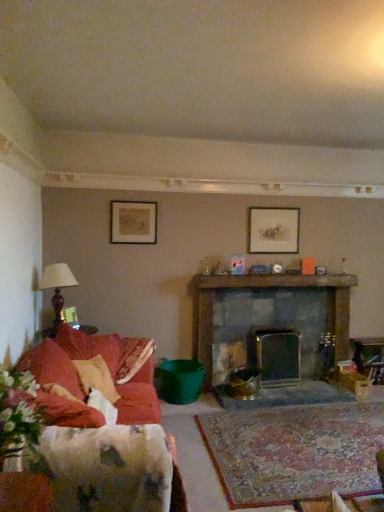
Question: Is the depth of velvet red couch at left greater than that of matte gold picture frame at left, arranged as the first picture frame when viewed from the front?

Choices:
 (A) yes
 (B) no

Answer: (B)

Question: Is matte gold picture frame at left, which is counted as the third picture frame, starting from the top, at the back of velvet red couch at left?

Choices:
 (A) no
 (B) yes

Answer: (B)

Question: Can you confirm if velvet red couch at left is thinner than matte gold picture frame at left, marked as the first picture frame in a left-to-right arrangement?

Choices:
 (A) yes
 (B) no

Answer: (B)

Question: Considering the relative sizes of velvet red couch at left and matte gold picture frame at left, the first picture frame when ordered from bottom to top, in the image provided, is velvet red couch at left shorter than matte gold picture frame at left, the first picture frame when ordered from bottom to top,?

Choices:
 (A) yes
 (B) no

Answer: (B)

Question: From a real-world perspective, is velvet red couch at left positioned under matte gold picture frame at left, the first picture frame when ordered from bottom to top, based on gravity?

Choices:
 (A) no
 (B) yes

Answer: (B)

Question: Considering the positions of matte black picture frame at upper left, which ranks as the 2th picture frame in right-to-left order, and velvet red couch at left in the image, is matte black picture frame at upper left, which ranks as the 2th picture frame in right-to-left order, taller or shorter than velvet red couch at left?

Choices:
 (A) tall
 (B) short

Answer: (B)

Question: In terms of width, does matte black picture frame at upper left, which is counted as the 3th picture frame, starting from the bottom, look wider or thinner when compared to velvet red couch at left?

Choices:
 (A) thin
 (B) wide

Answer: (A)

Question: Based on their positions, is matte black picture frame at upper left, marked as the first picture frame in a top-to-bottom arrangement, located to the left or right of velvet red couch at left?

Choices:
 (A) right
 (B) left

Answer: (A)

Question: Choose the correct answer: Is matte black picture frame at upper left, marked as the first picture frame in a top-to-bottom arrangement, inside velvet red couch at left or outside it?

Choices:
 (A) outside
 (B) inside

Answer: (A)

Question: From the image's perspective, is velvet red couch at left positioned above or below matte brown lamp at left?

Choices:
 (A) above
 (B) below

Answer: (B)

Question: From a real-world perspective, is velvet red couch at left above or below matte brown lamp at left?

Choices:
 (A) below
 (B) above

Answer: (A)

Question: Considering their positions, is velvet red couch at left located in front of or behind matte brown lamp at left?

Choices:
 (A) behind
 (B) front

Answer: (B)

Question: In the image, is velvet red couch at left on the left side or the right side of matte brown lamp at left?

Choices:
 (A) right
 (B) left

Answer: (A)

Question: Considering the positions of point (266, 215) and point (39, 281), is point (266, 215) closer or farther from the camera than point (39, 281)?

Choices:
 (A) closer
 (B) farther

Answer: (B)

Question: From the image's perspective, is matte silver picture frame at upper center, which is the first picture frame from right to left, located above or below matte brown lamp at left?

Choices:
 (A) below
 (B) above

Answer: (B)